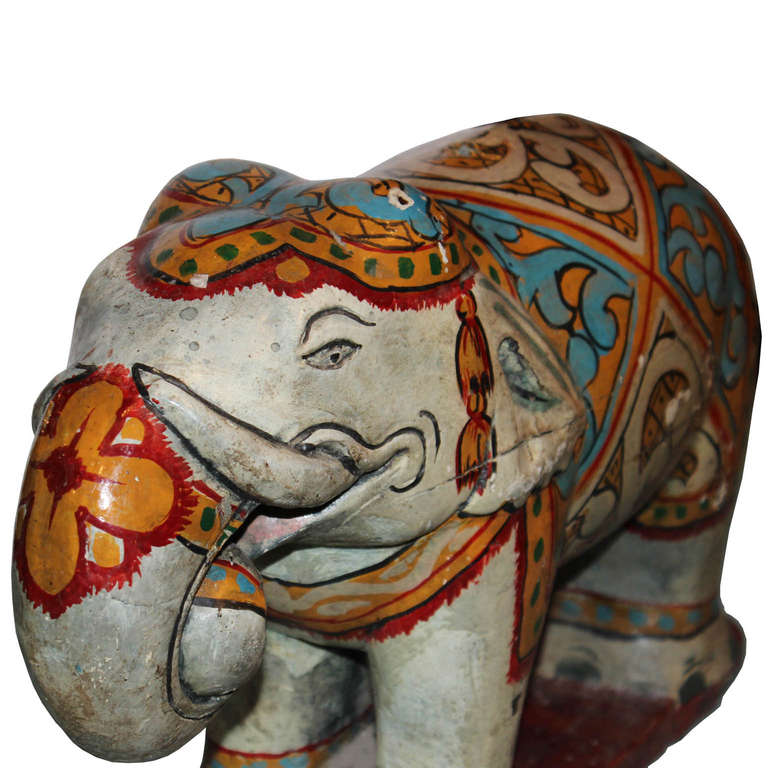
Locate an element on the screen. elephant figurine is located at coordinates (174, 346).